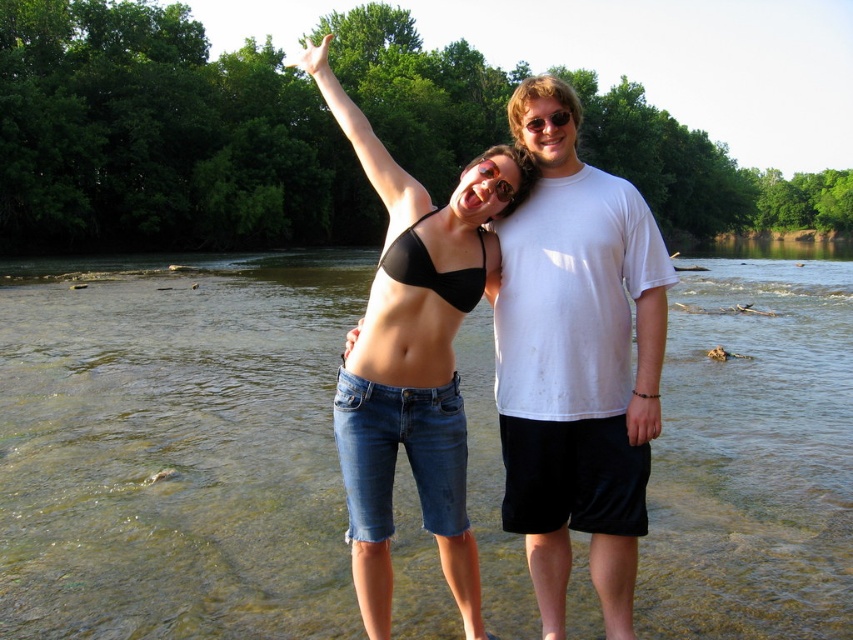
Is white cotton t-shirt at center positioned before black matte bikini top at center?

No, white cotton t-shirt at center is further to the viewer.

Between point (637, 400) and point (471, 305), which one is positioned behind?

Point (471, 305)

Is point (601, 182) positioned behind point (459, 298)?

Yes, it is.

Where is `white cotton t-shirt at center`? white cotton t-shirt at center is located at coordinates (576, 360).

Can you confirm if black denim shorts at center is positioned to the left of black matte bikini top at center?

Indeed, black denim shorts at center is positioned on the left side of black matte bikini top at center.

Does point (318, 77) come farther from viewer compared to point (485, 262)?

Yes, it is behind point (485, 262).

Find the location of `black denim shorts at center`. black denim shorts at center is located at coordinates (413, 355).

Find the location of a particular element. The image size is (853, 640). white cotton t-shirt at center is located at coordinates (576, 360).

Is point (635, 436) farther from viewer compared to point (416, 268)?

Yes, it is behind point (416, 268).

Where is `white cotton t-shirt at center`? The height and width of the screenshot is (640, 853). white cotton t-shirt at center is located at coordinates (576, 360).

Where is `white cotton t-shirt at center`? The width and height of the screenshot is (853, 640). white cotton t-shirt at center is located at coordinates (576, 360).